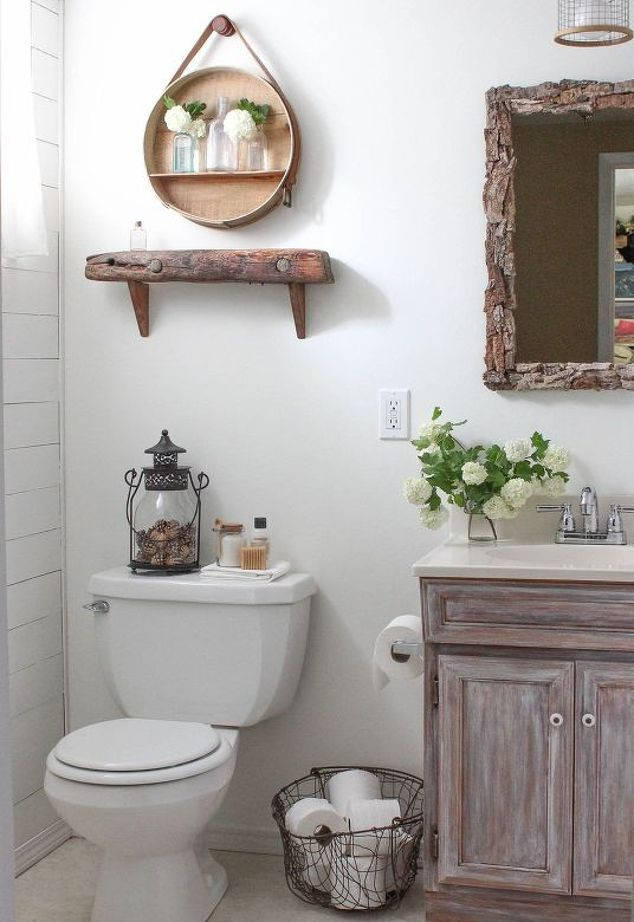
The image size is (634, 922). What are the coordinates of `cabinet doors` in the screenshot? It's located at [x=615, y=762], [x=529, y=790].